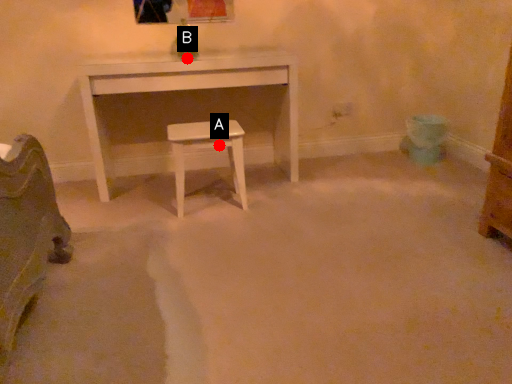
Question: Two points are circled on the image, labeled by A and B beside each circle. Which point is closer to the camera?

Choices:
 (A) A is closer
 (B) B is closer

Answer: (A)